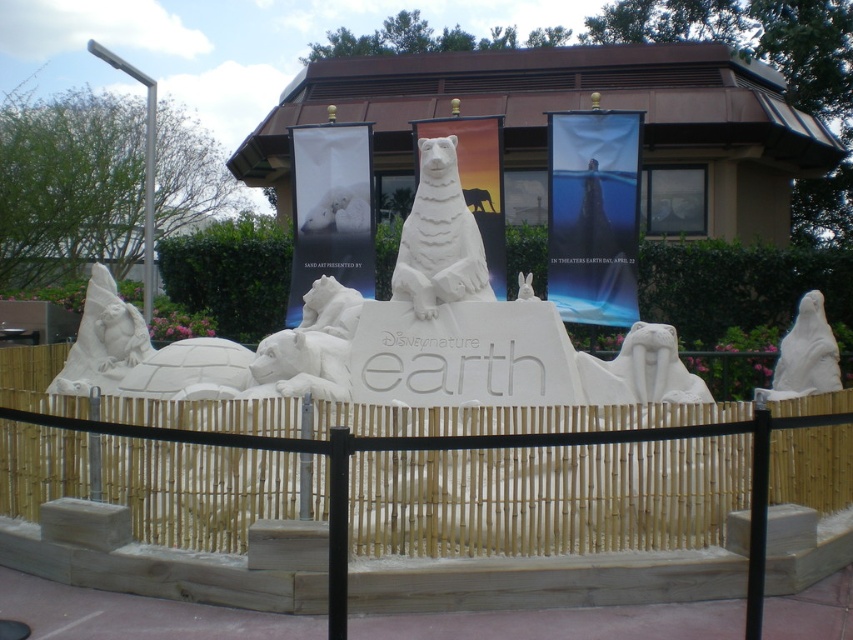
Can you confirm if bamboo fence at center is taller than white stone walrus at center?

Yes, bamboo fence at center is taller than white stone walrus at center.

Between point (142, 531) and point (659, 342), which one is positioned in front?

Point (142, 531)

Is point (254, 481) less distant than point (606, 392)?

Yes.

Find the location of `bamboo fence at center`. bamboo fence at center is located at coordinates (547, 497).

Which is below, white sand bear at center or white stone statue at center?

white stone statue at center

Who is taller, white sand bear at center or white stone statue at center?

white sand bear at center

In order to click on white sand bear at center in this screenshot , I will do `click(439, 237)`.

Which of these two, white stone turtle at left or white stone walrus at center, stands shorter?

With less height is white stone walrus at center.

Is white stone turtle at left to the left of white stone walrus at center from the viewer's perspective?

Yes, white stone turtle at left is to the left of white stone walrus at center.

Is point (76, 369) positioned in front of point (634, 376)?

No, (76, 369) is further to viewer.

Where is `white stone turtle at left`? The height and width of the screenshot is (640, 853). white stone turtle at left is located at coordinates (138, 353).